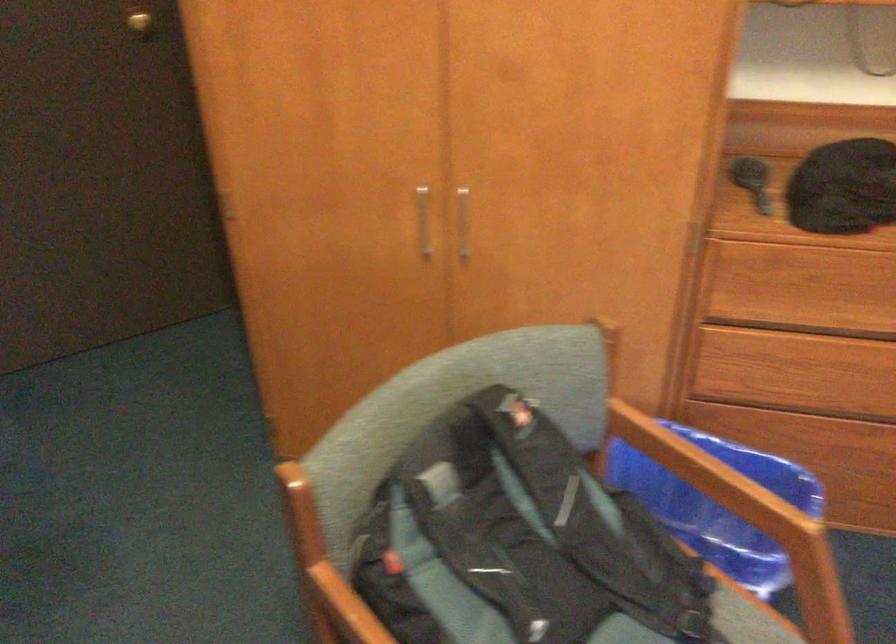
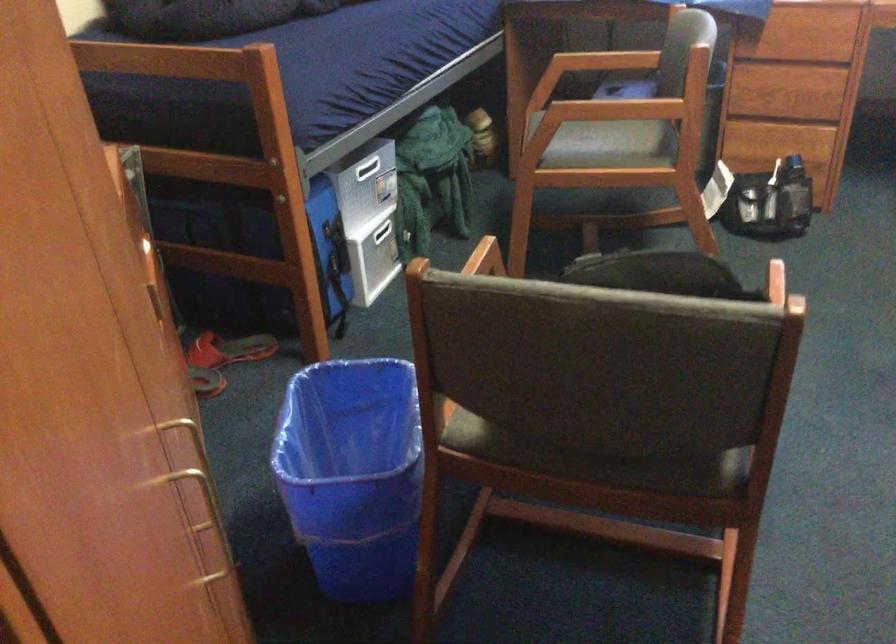
In the second image, find the point that corresponds to (437,498) in the first image.

(659, 272)